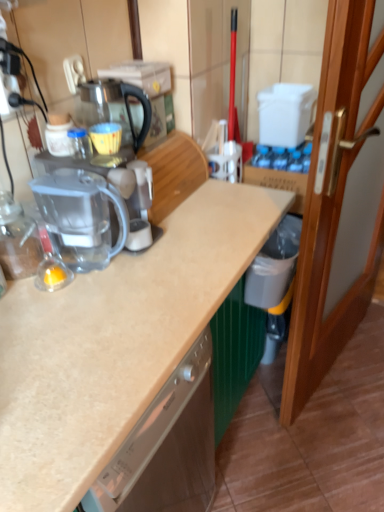
Question: From the image's perspective, relative to wooden door at right, is transparent glass coffeepot at center above or below?

Choices:
 (A) below
 (B) above

Answer: (B)

Question: Considering their positions, is transparent glass coffeepot at center located in front of or behind wooden door at right?

Choices:
 (A) behind
 (B) front

Answer: (A)

Question: Which object is positioned closest to the white plastic electric outlet at upper left?

Choices:
 (A) transparent plastic blender at left
 (B) transparent plastic coffee machine at center
 (C) transparent glass coffeepot at center
 (D) wooden door at right

Answer: (C)

Question: Which is nearer to the transparent glass coffeepot at center?

Choices:
 (A) wooden door at right
 (B) transparent plastic coffee machine at center
 (C) transparent plastic blender at left
 (D) white plastic electric outlet at upper left

Answer: (D)